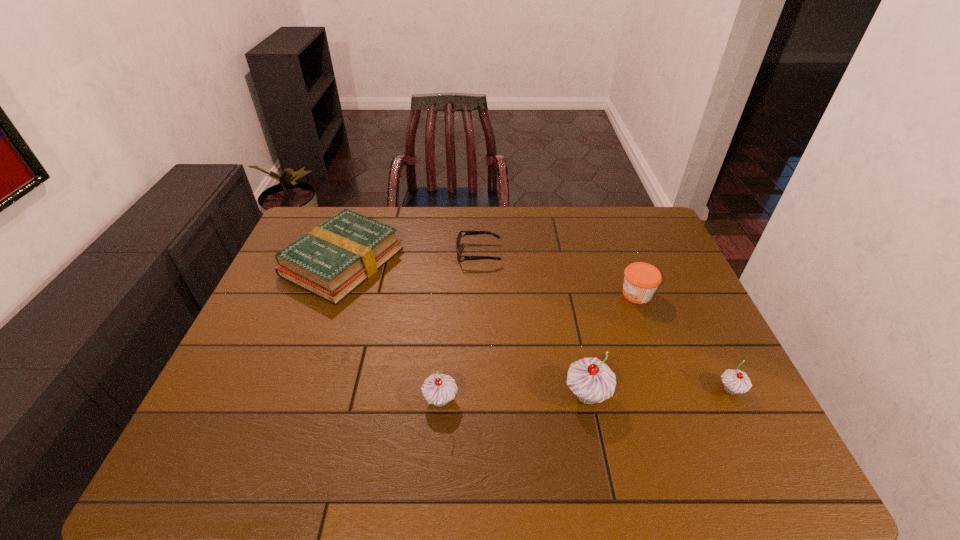
You are a GUI agent. You are given a task and a screenshot of the screen. Output one action in this format:
    pyautogui.click(x=<x>, y=<y>)
    Task: Click on the cupcake present at the right edge
    
    Given the screenshot: What is the action you would take?
    pyautogui.click(x=735, y=381)

Find the location of `jam located at the right edge`. jam located at the right edge is located at coordinates (641, 280).

What are the coordinates of `object present at the far left corner` in the screenshot? It's located at (332, 260).

Identify the location of object at the near right corner. (735, 381).

The image size is (960, 540). In the image, there is a desktop. What are the coordinates of `free space at the far edge` in the screenshot? It's located at 602,218.

Where is `free spot at the near edge of the desktop`? free spot at the near edge of the desktop is located at coordinates (396, 414).

The height and width of the screenshot is (540, 960). In order to click on free region at the left edge in this screenshot , I will do pyautogui.click(x=284, y=319).

What are the coordinates of `free region at the far left corner of the desktop` in the screenshot? It's located at (321, 224).

Find the location of a particular element. The height and width of the screenshot is (540, 960). vacant space in between the jam and the rightmost object is located at coordinates (684, 342).

You are a GUI agent. You are given a task and a screenshot of the screen. Output one action in this format:
    pyautogui.click(x=<x>, y=<y>)
    Task: Click on the vacant space that's between the second tallest object and the shortest object
    Image resolution: width=960 pixels, height=540 pixels.
    Given the screenshot: What is the action you would take?
    pyautogui.click(x=460, y=327)